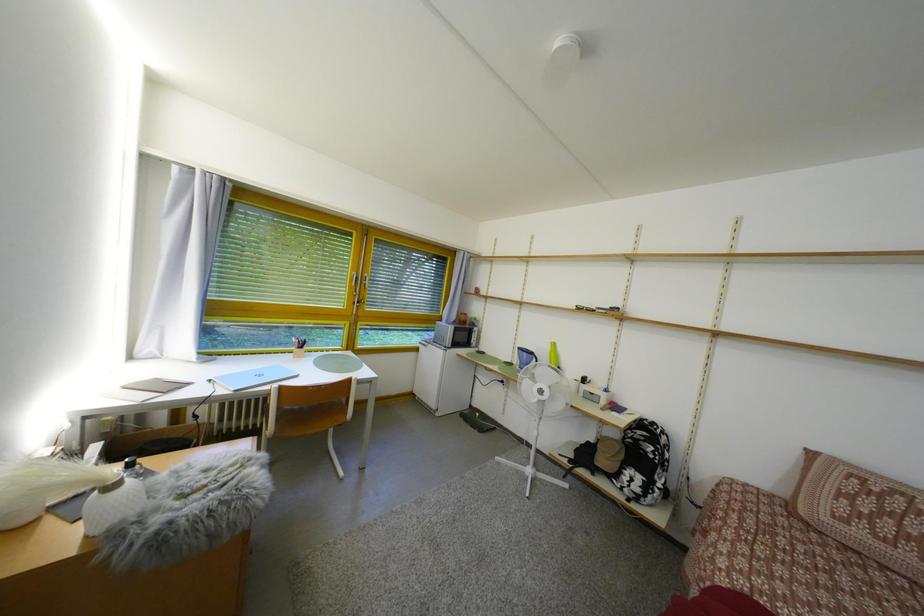
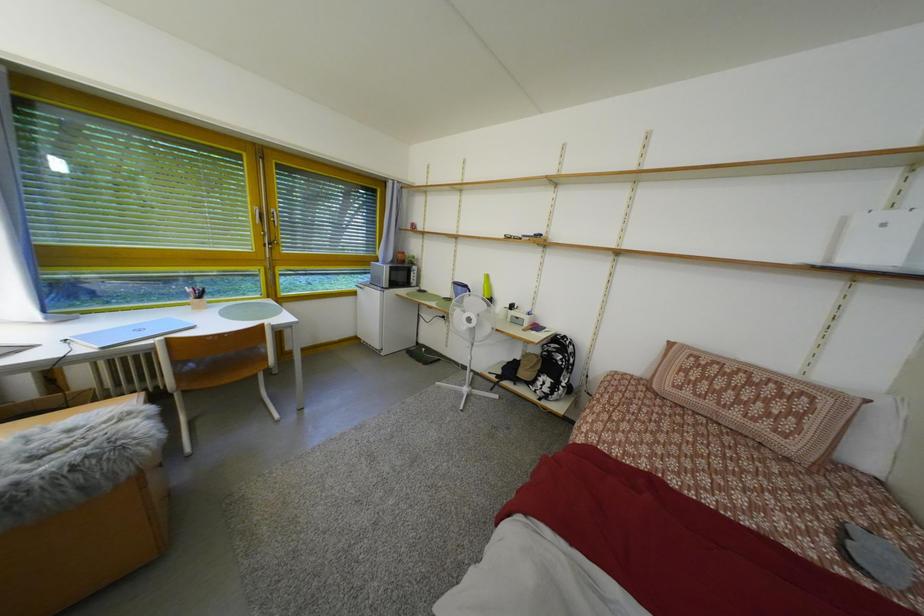
Question: What movement of the cameraman would produce the second image?

Choices:
 (A) Left
 (B) Right
 (C) Forward
 (D) Backward

Answer: (B)